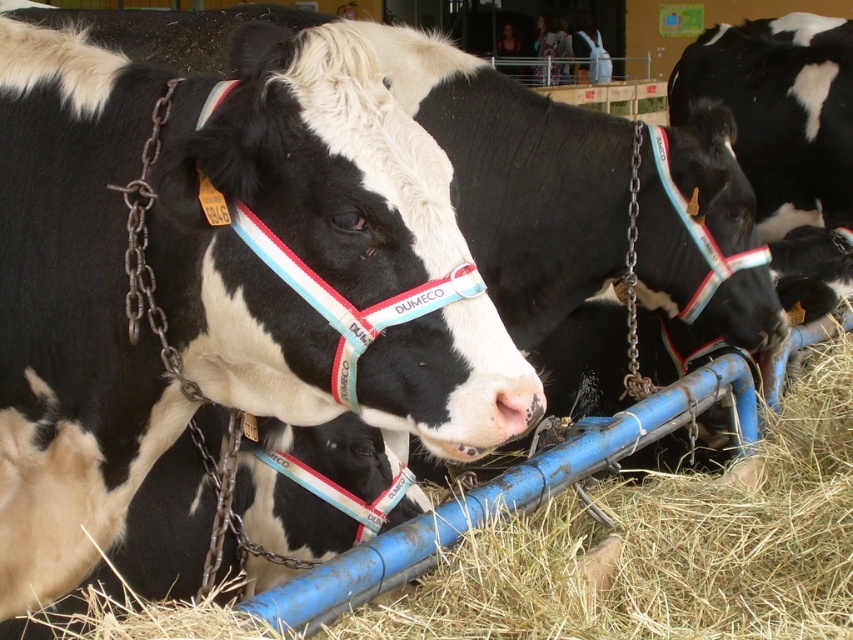
Who is more distant from viewer, (125, 253) or (630, 253)?

Positioned behind is point (630, 253).

Does metallic chain at left appear on the right side of metallic chain at center?

No, metallic chain at left is not to the right of metallic chain at center.

In order to click on metallic chain at left in this screenshot , I will do `click(144, 253)`.